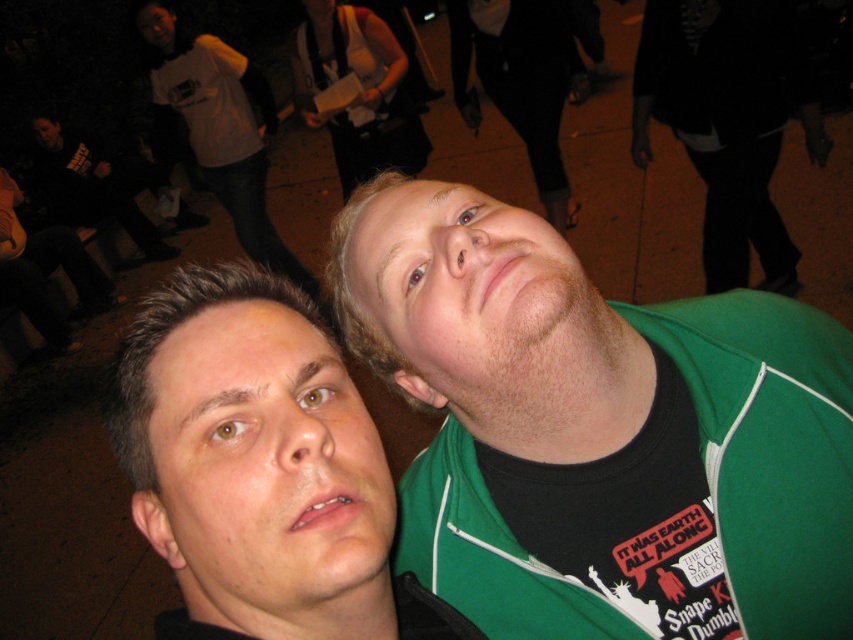
Question: Is green fabric shirt at upper right further to camera compared to white cotton shirt at upper left?

Choices:
 (A) yes
 (B) no

Answer: (B)

Question: Among these objects, which one is farthest from the camera?

Choices:
 (A) matte black jacket at upper left
 (B) matte black face at center
 (C) green fabric shirt at upper right
 (D) white cotton shirt at upper left

Answer: (A)

Question: Which of the following is the closest to the observer?

Choices:
 (A) [198, 109]
 (B) [351, 504]

Answer: (B)

Question: Among these objects, which one is nearest to the camera?

Choices:
 (A) white cotton shirt at upper left
 (B) green fabric shirt at upper right
 (C) matte black jacket at upper left
 (D) matte black face at center

Answer: (D)

Question: Where is matte black face at center located in relation to white cotton shirt at upper left in the image?

Choices:
 (A) above
 (B) below

Answer: (B)

Question: Does matte black face at center lie in front of white cotton shirt at upper left?

Choices:
 (A) no
 (B) yes

Answer: (B)